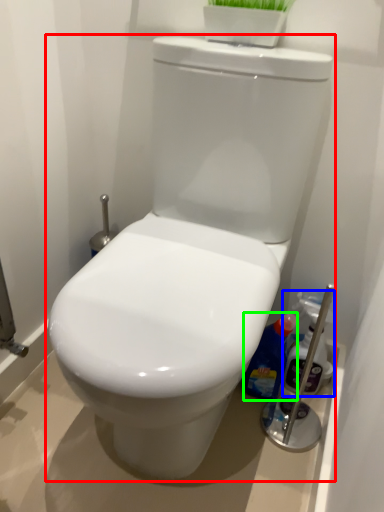
Question: Estimate the real-world distances between objects in this image. Which object is closer to toilet (highlighted by a red box), cleaning product (highlighted by a blue box) or cleaning product (highlighted by a green box)?

Choices:
 (A) cleaning product
 (B) cleaning product

Answer: (B)